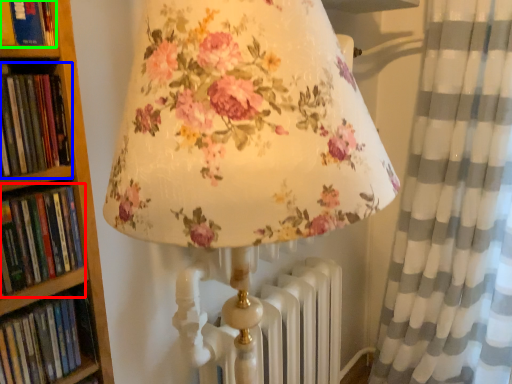
Question: Which object is positioned closest to book (highlighted by a red box)? Select from book (highlighted by a blue box) and book (highlighted by a green box).

Choices:
 (A) book
 (B) book

Answer: (A)